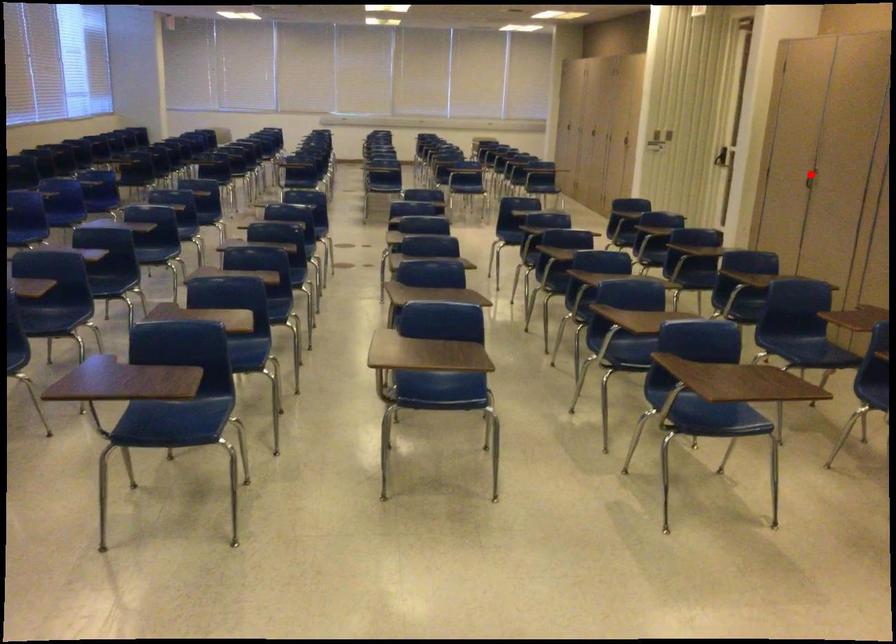
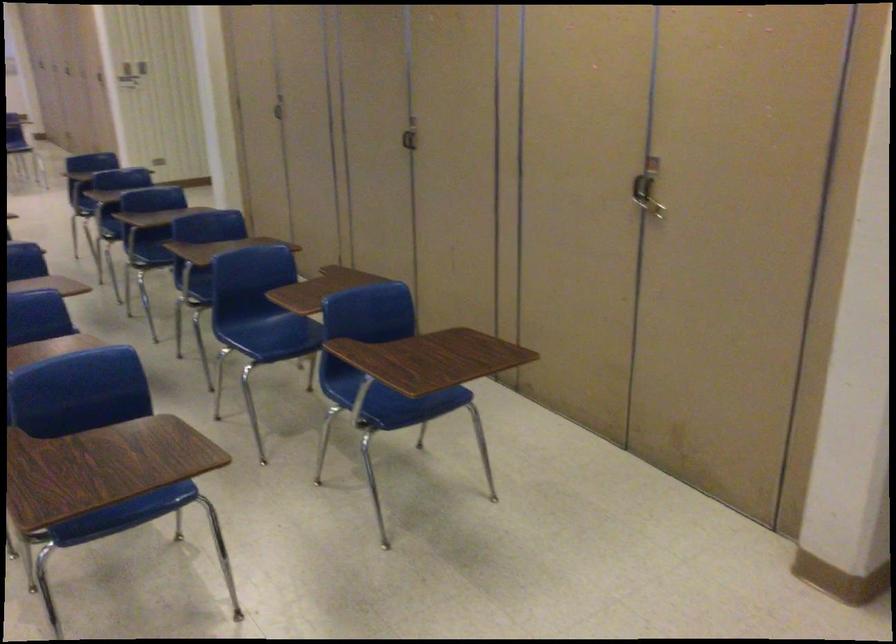
Question: A red point is marked in image1. In image2, is the corresponding 3D point closer to the camera or farther? Reply with the corresponding letter.

Choices:
 (A) The corresponding 3D point is closer.
 (B) The corresponding 3D point is farther.

Answer: (A)